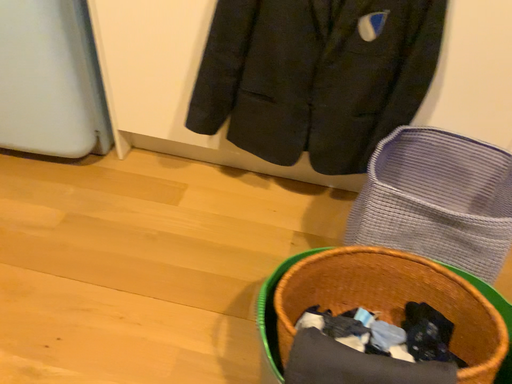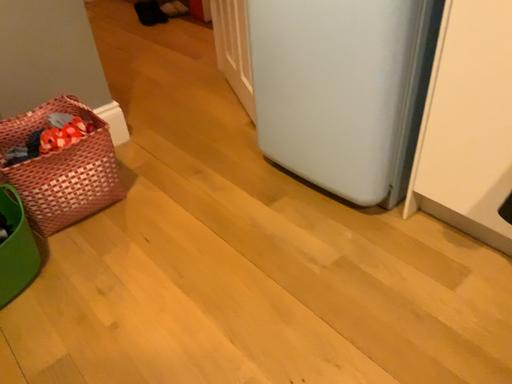
Question: How did the camera likely rotate when shooting the video?

Choices:
 (A) rotated left
 (B) rotated right

Answer: (A)